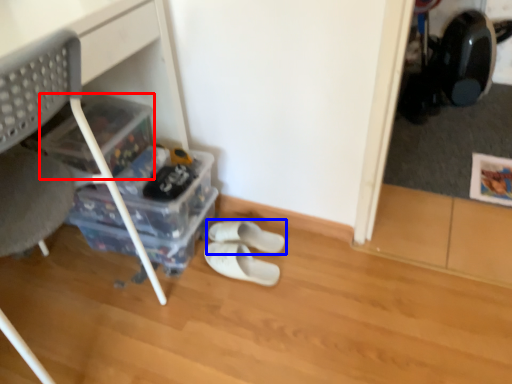
Question: Among these objects, which one is farthest to the camera, storage box (highlighted by a red box) or footwear (highlighted by a blue box)?

Choices:
 (A) storage box
 (B) footwear

Answer: (B)